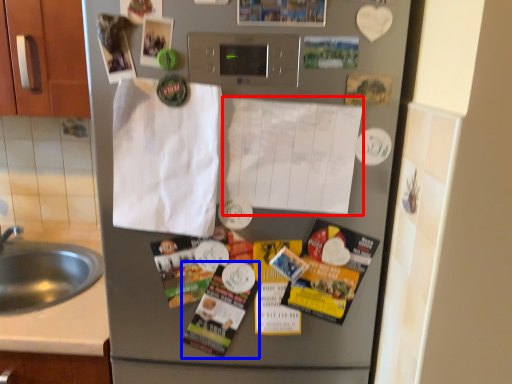
Question: Among these objects, which one is nearest to the camera, paper (highlighted by a red box) or magazine (highlighted by a blue box)?

Choices:
 (A) paper
 (B) magazine

Answer: (A)